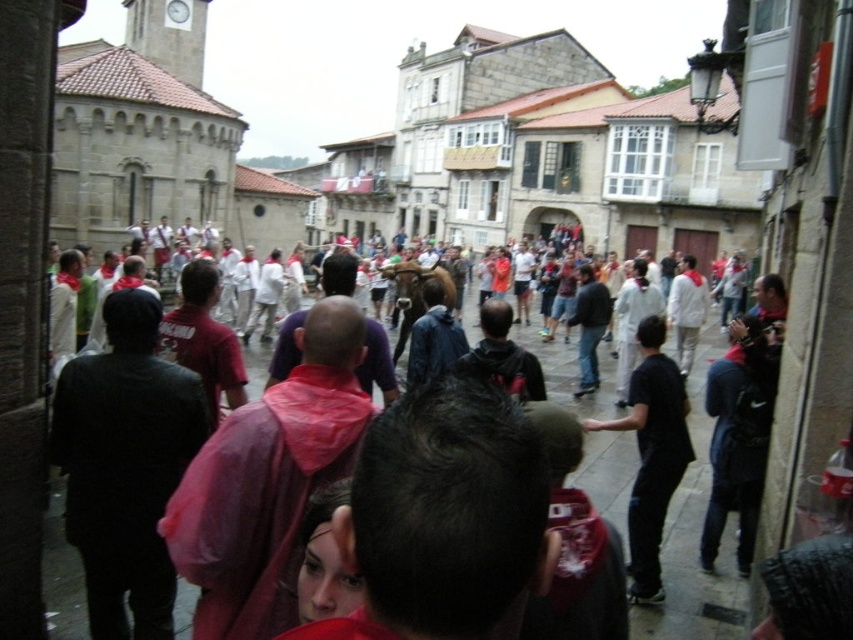
Is pink raincoat at center above black matte shirt at center?

Yes.

Between pink raincoat at center and black matte shirt at center, which one is positioned lower?

black matte shirt at center

What are the coordinates of `pink raincoat at center` in the screenshot? It's located at (695, 536).

Locate an element on the screen. The image size is (853, 640). pink raincoat at center is located at coordinates click(x=695, y=536).